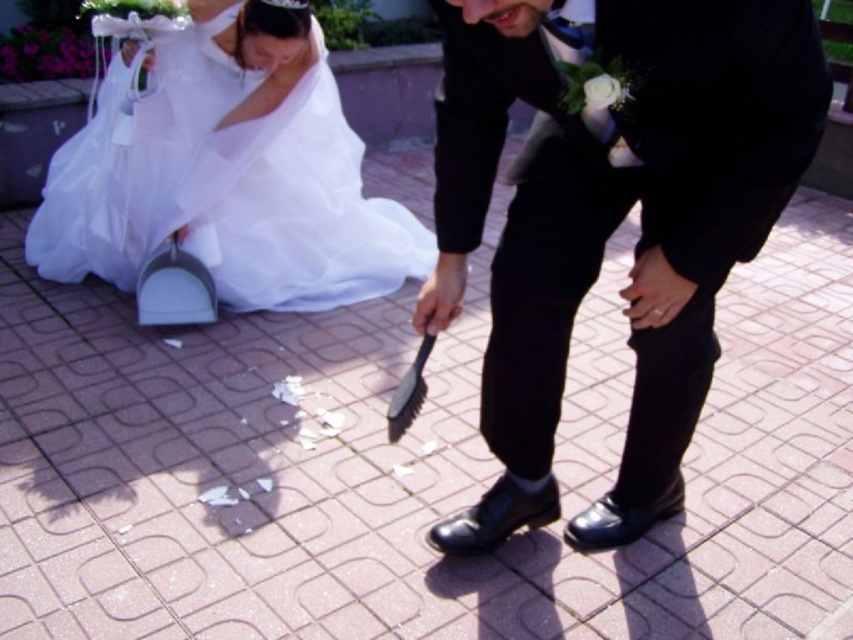
Does point (659, 268) come closer to viewer compared to point (171, 104)?

That is True.

Does black leather shoes at lower center have a greater height compared to white sheer dress at lower left?

Yes, black leather shoes at lower center is taller than white sheer dress at lower left.

Which is in front, point (546, 266) or point (109, 140)?

Point (546, 266) is more forward.

I want to click on black leather shoes at lower center, so click(x=611, y=221).